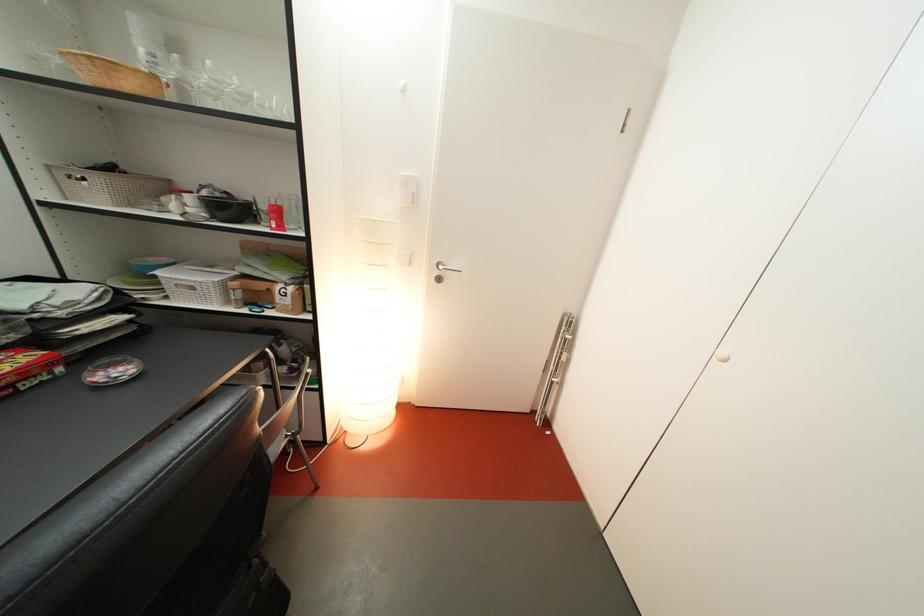
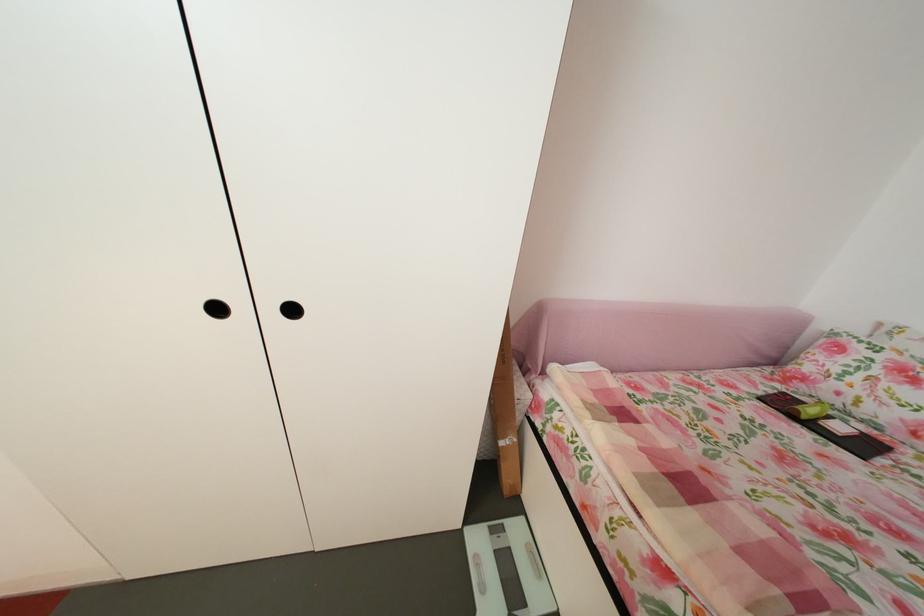
The first image is from the beginning of the video and the second image is from the end. How did the camera likely rotate when shooting the video?

The camera's rotation is toward right-down.